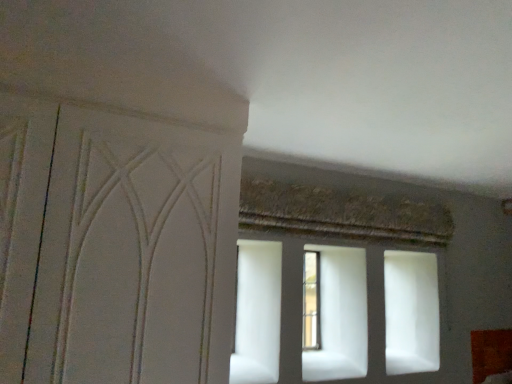
Question: Is white matte screen door at left not near clear glass window at center?

Choices:
 (A) no
 (B) yes

Answer: (B)

Question: Considering the relative sizes of white matte screen door at left and clear glass window at center in the image provided, is white matte screen door at left thinner than clear glass window at center?

Choices:
 (A) no
 (B) yes

Answer: (A)

Question: Can we say white matte screen door at left lies outside clear glass window at center?

Choices:
 (A) yes
 (B) no

Answer: (A)

Question: From the image's perspective, does white matte screen door at left appear higher than clear glass window at center?

Choices:
 (A) yes
 (B) no

Answer: (A)

Question: Is white matte screen door at left aimed at clear glass window at center?

Choices:
 (A) yes
 (B) no

Answer: (B)

Question: From the image's perspective, is white matte screen door at left beneath clear glass window at center?

Choices:
 (A) no
 (B) yes

Answer: (A)

Question: Considering the relative positions of clear glass window at center and white matte screen door at left in the image provided, is clear glass window at center to the left of white matte screen door at left from the viewer's perspective?

Choices:
 (A) no
 (B) yes

Answer: (A)

Question: From the image's perspective, is clear glass window at center located above white matte screen door at left?

Choices:
 (A) no
 (B) yes

Answer: (A)

Question: Is clear glass window at center positioned with its back to white matte screen door at left?

Choices:
 (A) yes
 (B) no

Answer: (B)

Question: Is the depth of clear glass window at center less than that of white matte screen door at left?

Choices:
 (A) no
 (B) yes

Answer: (A)

Question: Can we say clear glass window at center lies outside white matte screen door at left?

Choices:
 (A) yes
 (B) no

Answer: (A)

Question: From the image's perspective, does clear glass window at center appear lower than white matte screen door at left?

Choices:
 (A) yes
 (B) no

Answer: (A)

Question: In the image, is white matte screen door at left positioned in front of or behind clear glass window at center?

Choices:
 (A) behind
 (B) front

Answer: (B)